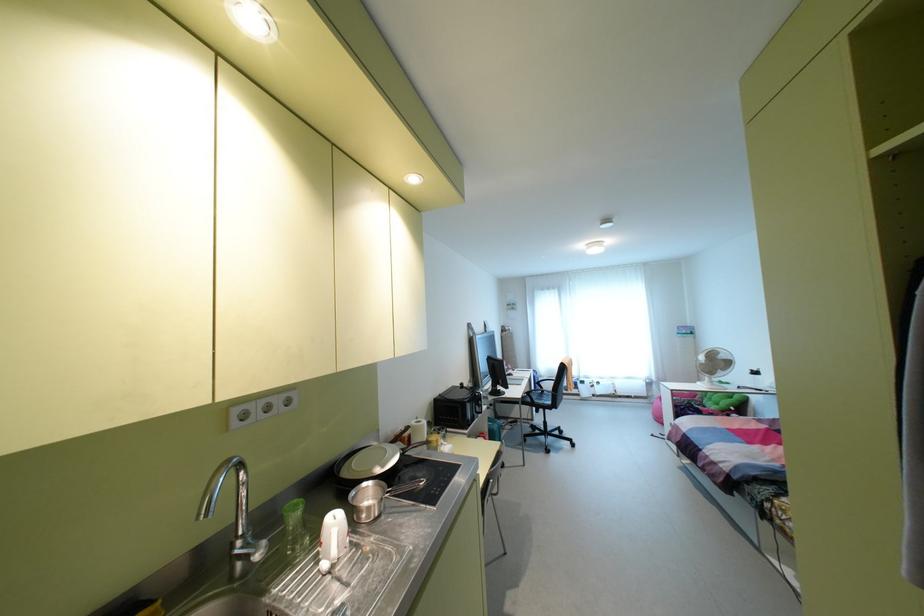
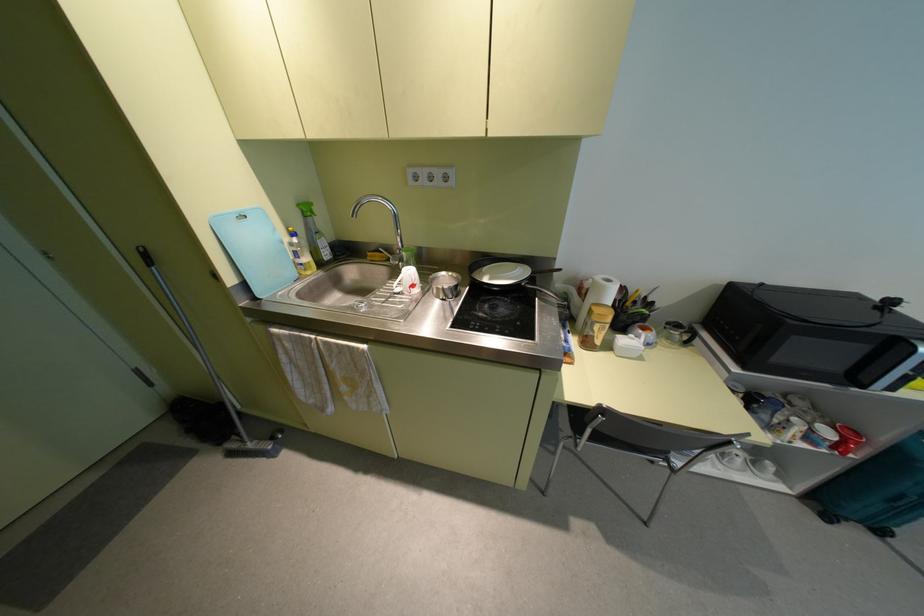
Find the pixel in the second image that matches (x=412, y=423) in the first image.

(599, 277)